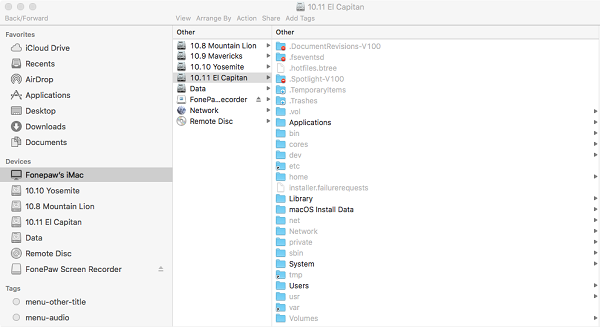
This screenshot has width=600, height=327. Identify the location of devices. (38, 174), (43, 190), (43, 203), (40, 218), (30, 236), (40, 253), (48, 267).